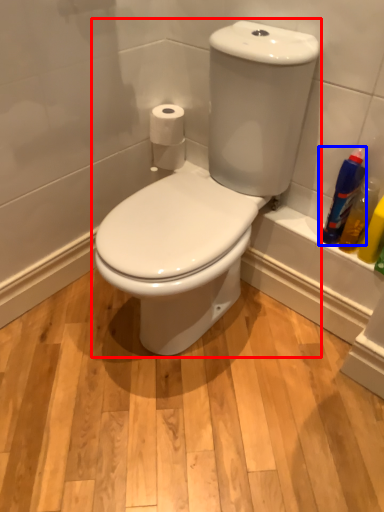
Question: Which of the following is the farthest to the observer, toilet (highlighted by a red box) or cleaning product (highlighted by a blue box)?

Choices:
 (A) toilet
 (B) cleaning product

Answer: (B)